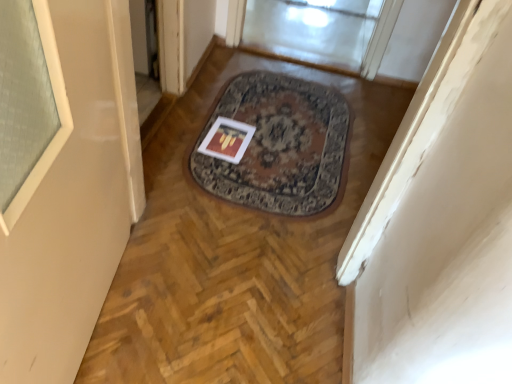
Find the location of a particular element. This screenshot has height=384, width=512. free space in front of matte paper postcard at center is located at coordinates (220, 175).